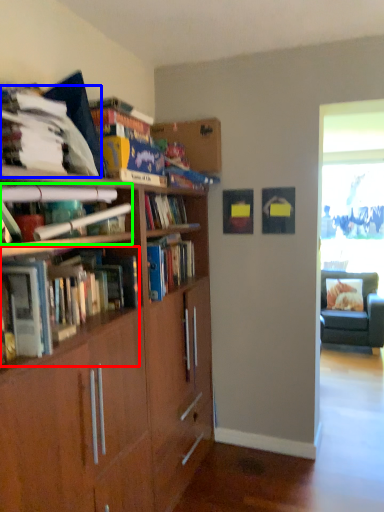
Question: Based on their relative distances, which object is nearer to book (highlighted by a red box)? Choose from book (highlighted by a blue box) and book (highlighted by a green box).

Choices:
 (A) book
 (B) book

Answer: (B)